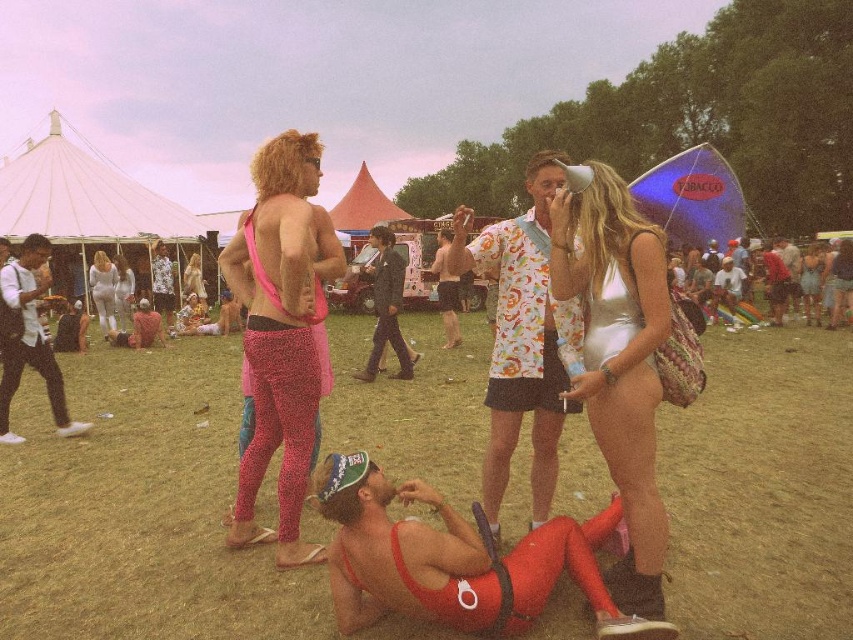
You are a photographer at the festival and want to capture both the pink spandex bikini top at center and the printed cotton shirt at center in the same frame. Which one should you focus on first to ensure both are in the shot?

The pink spandex bikini top at center is positioned on the left side of the printed cotton shirt at center, so you should focus on the printed cotton shirt at center first to ensure both are in the shot.